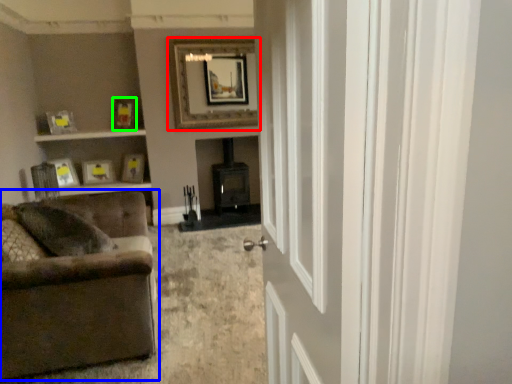
Question: Estimate the real-world distances between objects in this image. Which object is closer to picture frame (highlighted by a red box), studio couch (highlighted by a blue box) or picture frame (highlighted by a green box)?

Choices:
 (A) studio couch
 (B) picture frame

Answer: (B)